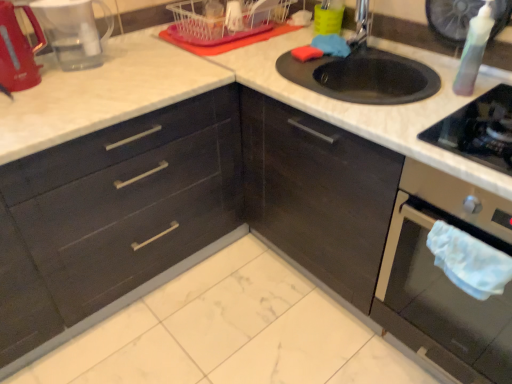
Image resolution: width=512 pixels, height=384 pixels. Find the location of `free point to the right of red plastic coffee maker at upper left`. free point to the right of red plastic coffee maker at upper left is located at coordinates (x=135, y=67).